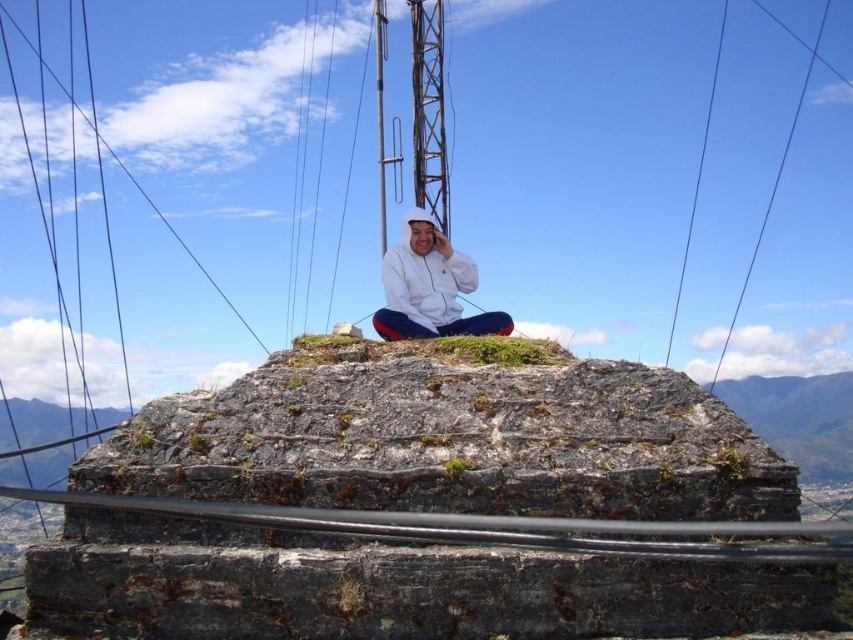
You are standing at the base of the rocky outcrop and want to reach the person sitting on top. There are two points marked on the rock face that you can use as handholds. The first point is at coordinates point (457, 316) and the second is at point (722, 26). Which point should you grab first to start your climb?

You should grab point (457, 316) first because it is closer to the viewer than point (722, 26), making it easier to reach when starting the climb.

You are a hiker who has just reached the top of a rocky outcrop. You see a point marked at coordinates [428,288]. What object is located at that point?

The point at coordinates [428,288] marks the white matte jacket at center.

You are a photographer trying to capture the scene of the person on the rocky outcrop. You notice the white matte jacket at center and the black wire at upper right in your viewfinder. Which object should you adjust your focus on if you want to ensure the larger object is in sharp detail?

The black wire at upper right is larger than the white matte jacket at center, so you should focus on the black wire at upper right to ensure the larger object is in sharp detail.